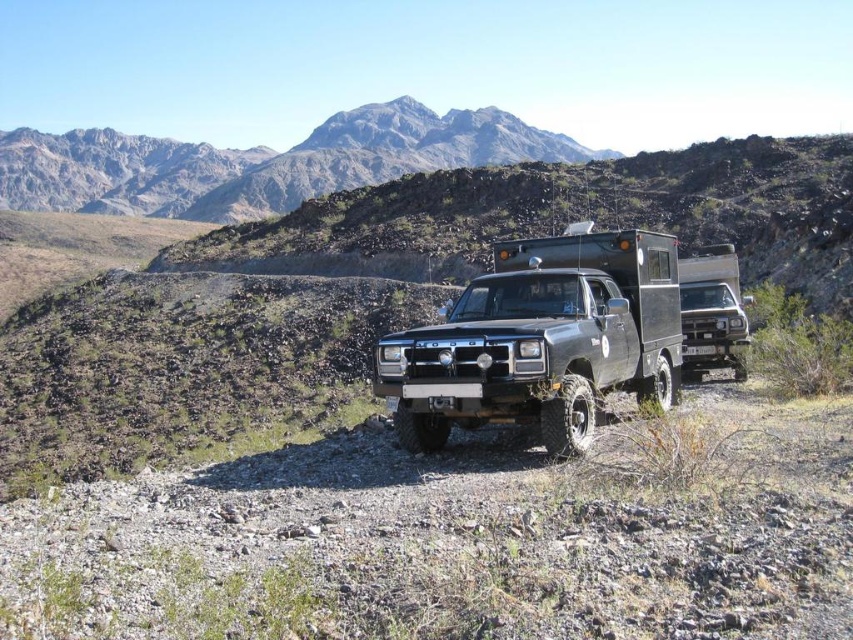
You are standing at the point labeled point (669, 291) and want to walk to the point labeled point (709, 339). Which direction should you move in relation to the camera?

You should move away from the camera because point (709, 339) is farther from the camera than point (669, 291).

Based on the photo, you are a hiker planning to take a photo of the rugged granite mountain at upper center. You want to frame the shot so that the black matte truck at center is partially visible on the side of the mountain. Which side of the mountain should you position yourself to capture this composition?

You should position yourself on the right side of the rugged granite mountain at upper center because the black matte truck at center is positioned on the right side of it, allowing you to include both in the frame.

You are a hiker planning to cross the terrain between the black matte truck at center and the rugged granite mountain at upper center. The path is rocky and uneven. If your hiking gear can handle up to 200 meters of rugged terrain, will you be able to complete the journey?

The distance between the black matte truck at center and the rugged granite mountain at upper center is 206.50 meters. Since your gear can handle up to 200 meters, you will not be able to complete the journey as the distance exceeds the gear limit.